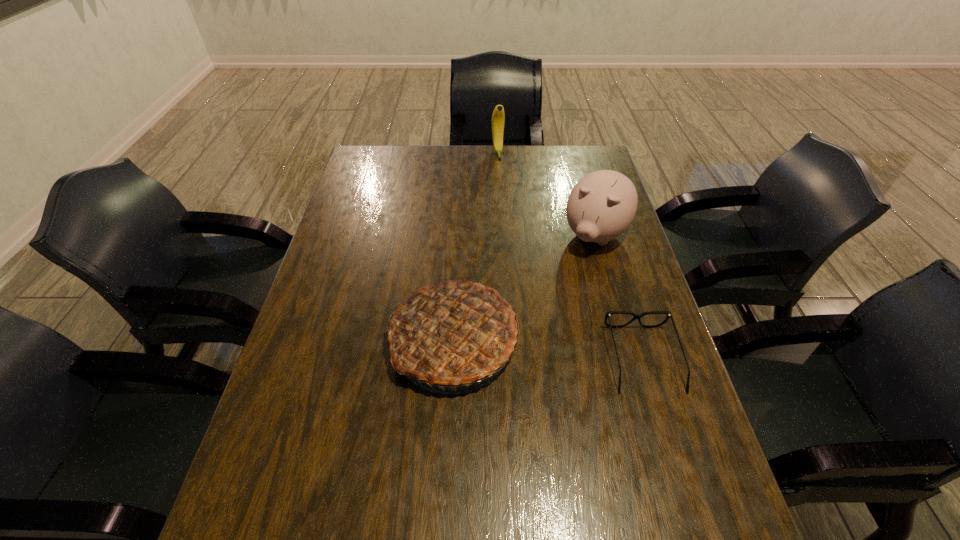
Locate an element on the screen. This screenshot has width=960, height=540. vacant area between the shortest object and the third nearest object is located at coordinates (619, 297).

Where is `free area in between the farthest object and the spectacles`? The height and width of the screenshot is (540, 960). free area in between the farthest object and the spectacles is located at coordinates (570, 255).

Locate an element on the screen. free space that is in between the farthest object and the pie is located at coordinates (475, 246).

At what (x,y) coordinates should I click in order to perform the action: click on free space between the pie and the farthest object. Please return your answer as a coordinate pair (x, y). Looking at the image, I should click on (475, 246).

This screenshot has height=540, width=960. What are the coordinates of `vacant region between the piggy bank and the shortest object` in the screenshot? It's located at (619, 297).

Identify the location of vacant space that is in between the second farthest object and the banana. This screenshot has height=540, width=960. (546, 194).

At what (x,y) coordinates should I click in order to perform the action: click on vacant space in between the second farthest object and the spectacles. Please return your answer as a coordinate pair (x, y). The image size is (960, 540). Looking at the image, I should click on [x=619, y=297].

Image resolution: width=960 pixels, height=540 pixels. I want to click on free spot between the farthest object and the second farthest object, so click(546, 194).

At what (x,y) coordinates should I click in order to perform the action: click on vacant space in between the second farthest object and the shortest object. Please return your answer as a coordinate pair (x, y). The image size is (960, 540). Looking at the image, I should click on (619, 297).

What are the coordinates of `free space between the piggy bank and the pie` in the screenshot? It's located at (524, 287).